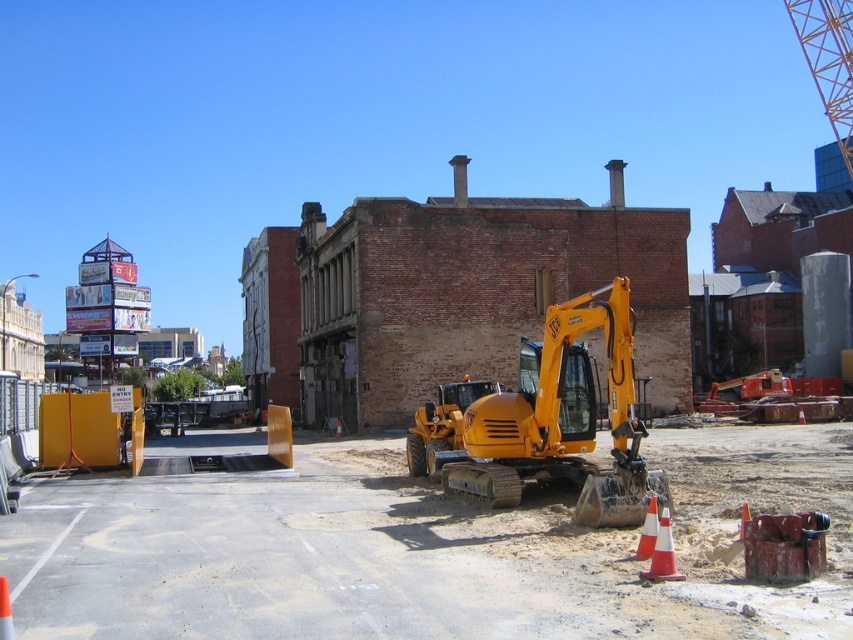
You are a construction worker standing at the point with coordinates point (553, 420). What object are you currently standing on?

You are standing on the yellow rubber excavator at center.

You are a construction worker standing at the orange reflective cone at lower right. Looking towards the yellow rubber excavator at center, which direction should you move to reach it?

The yellow rubber excavator at center is above the orange reflective cone at lower right, so you should move upward to reach it.